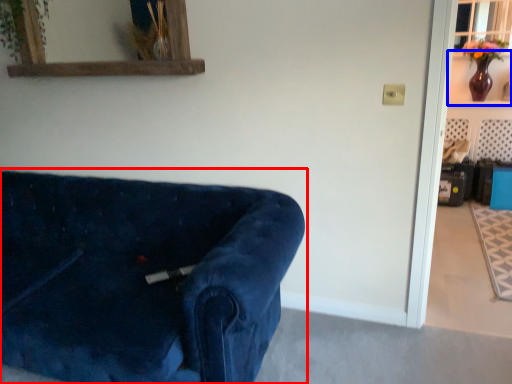
Question: Which of the following is the farthest to the observer, studio couch (highlighted by a red box) or shelf (highlighted by a blue box)?

Choices:
 (A) studio couch
 (B) shelf

Answer: (B)